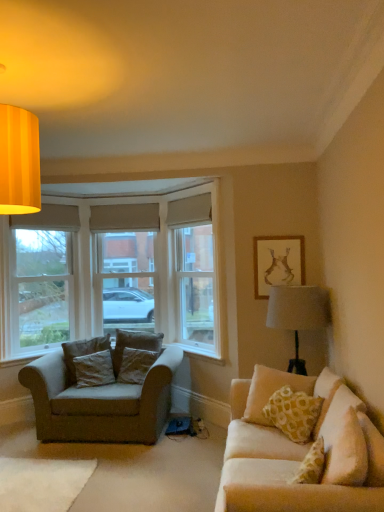
Measure the distance between point (x=124, y=395) and camera.

The depth of point (x=124, y=395) is 4.10 meters.

How much space does dark brown fabric pillow at left, which appears as the fourth pillow when viewed from the right, occupy vertically?

The height of dark brown fabric pillow at left, which appears as the fourth pillow when viewed from the right, is 19.35 inches.

This screenshot has height=512, width=384. What do you see at coordinates (135, 365) in the screenshot?
I see `dark gray fabric pillow at left, positioned as the 3th pillow in left-to-right order` at bounding box center [135, 365].

Describe the element at coordinates (41, 288) in the screenshot. I see `white painted wood window frame at left` at that location.

Measure the distance between white painted wood window frame at left and camera.

white painted wood window frame at left is 14.87 feet away from camera.

Find the location of `matte gold picture frame at upper right`. matte gold picture frame at upper right is located at coordinates (277, 263).

Is dark gray fabric pillow at left, the 3th pillow viewed from the front, outside of beige fabric window screen at center?

That's correct, dark gray fabric pillow at left, the 3th pillow viewed from the front, is outside of beige fabric window screen at center.

Is beige fabric window screen at center at the back of dark gray fabric pillow at left, which is the 2th pillow in back-to-front order?

No, dark gray fabric pillow at left, which is the 2th pillow in back-to-front order, is not facing away from beige fabric window screen at center.

Which object is wider, dark gray fabric pillow at left, placed as the 2th pillow when sorted from right to left, or beige fabric window screen at center?

beige fabric window screen at center is wider.

Considering the positions of points (138, 332) and (140, 432), is point (138, 332) farther from camera compared to point (140, 432)?

Yes.

Is textured beige pillow at center-left, which is the first pillow in back-to-front order, located outside velvet beige armchair at left?

No, textured beige pillow at center-left, which is the first pillow in back-to-front order, is not outside of velvet beige armchair at left.

Does textured beige pillow at center-left, placed as the second pillow when sorted from left to right, have a lesser width compared to velvet beige armchair at left?

Indeed, textured beige pillow at center-left, placed as the second pillow when sorted from left to right, has a lesser width compared to velvet beige armchair at left.

How distant is textured beige pillow at center-left, which ranks as the third pillow in right-to-left order, from dark gray fabric pillow at left, placed as the 2th pillow when sorted from right to left?

textured beige pillow at center-left, which ranks as the third pillow in right-to-left order, is 4.35 inches away from dark gray fabric pillow at left, placed as the 2th pillow when sorted from right to left.

Based on the photo, does textured beige pillow at center-left, placed as the second pillow when sorted from left to right, lie in front of dark gray fabric pillow at left, which is the 2th pillow in back-to-front order?

No, it is behind dark gray fabric pillow at left, which is the 2th pillow in back-to-front order.

Does textured beige pillow at center-left, which ranks as the 4th pillow in front-to-back order, have a larger size compared to dark gray fabric pillow at left, positioned as the 3th pillow in left-to-right order?

Yes.

From a real-world perspective, which is physically below, textured beige pillow at center-left, which ranks as the third pillow in right-to-left order, or beige fabric window screen at center?

textured beige pillow at center-left, which ranks as the third pillow in right-to-left order, is physically lower.

Considering the sizes of textured beige pillow at center-left, placed as the second pillow when sorted from left to right, and beige fabric window screen at center in the image, is textured beige pillow at center-left, placed as the second pillow when sorted from left to right, wider or thinner than beige fabric window screen at center?

Clearly, textured beige pillow at center-left, placed as the second pillow when sorted from left to right, has less width compared to beige fabric window screen at center.

How much distance is there between textured beige pillow at center-left, which is the first pillow in back-to-front order, and beige fabric window screen at center?

textured beige pillow at center-left, which is the first pillow in back-to-front order, and beige fabric window screen at center are 36.01 inches apart.

Which object is more forward, textured beige pillow at center-left, which ranks as the 4th pillow in front-to-back order, or beige fabric window screen at center?

beige fabric window screen at center is closer to the camera.

From a real-world perspective, is dark brown fabric pillow at left, the third pillow viewed from the back, on matte gold picture frame at upper right?

Actually, dark brown fabric pillow at left, the third pillow viewed from the back, is physically below matte gold picture frame at upper right in the real world.

In the scene shown: Considering the relative sizes of dark brown fabric pillow at left, the 2th pillow in the front-to-back sequence, and matte gold picture frame at upper right in the image provided, is dark brown fabric pillow at left, the 2th pillow in the front-to-back sequence, bigger than matte gold picture frame at upper right?

Yes.

Image resolution: width=384 pixels, height=512 pixels. Identify the location of pillow that is the 1st one when counting backward from the matte gold picture frame at upper right. (94, 369).

In the scene shown: From the image's perspective, is dark brown fabric pillow at left, the third pillow viewed from the back, beneath matte gold picture frame at upper right?

Yes, from the image's perspective, dark brown fabric pillow at left, the third pillow viewed from the back, is beneath matte gold picture frame at upper right.

Considering the sizes of dark gray fabric pillow at left, the 3th pillow viewed from the front, and velvet beige armchair at left in the image, is dark gray fabric pillow at left, the 3th pillow viewed from the front, taller or shorter than velvet beige armchair at left?

In the image, dark gray fabric pillow at left, the 3th pillow viewed from the front, appears to be shorter than velvet beige armchair at left.

Are dark gray fabric pillow at left, positioned as the 3th pillow in left-to-right order, and velvet beige armchair at left making contact?

No, dark gray fabric pillow at left, positioned as the 3th pillow in left-to-right order, is not touching velvet beige armchair at left.

From the image's perspective, between dark gray fabric pillow at left, placed as the 2th pillow when sorted from right to left, and velvet beige armchair at left, who is located below?

From the image's view, velvet beige armchair at left is below.

Consider the image. Considering the positions of objects dark gray fabric pillow at left, which is the 2th pillow in back-to-front order, and velvet beige armchair at left in the image provided, who is more to the left, dark gray fabric pillow at left, which is the 2th pillow in back-to-front order, or velvet beige armchair at left?

From the viewer's perspective, velvet beige armchair at left appears more on the left side.

Looking at their sizes, would you say velvet beige pillow at right, the fourth pillow in the left-to-right sequence, is wider or thinner than matte gold picture frame at upper right?

In the image, velvet beige pillow at right, the fourth pillow in the left-to-right sequence, appears to be wider than matte gold picture frame at upper right.

Is the surface of velvet beige pillow at right, the 4th pillow when ordered from back to front, in direct contact with matte gold picture frame at upper right?

velvet beige pillow at right, the 4th pillow when ordered from back to front, is not next to matte gold picture frame at upper right, and they're not touching.

From the picture: Is matte gold picture frame at upper right at the back of velvet beige pillow at right, the 4th pillow when ordered from back to front?

That's not correct — velvet beige pillow at right, the 4th pillow when ordered from back to front, is not looking away from matte gold picture frame at upper right.

Which object is positioned more to the left, velvet beige pillow at right, which appears as the 1th pillow when viewed from the right, or matte gold picture frame at upper right?

velvet beige pillow at right, which appears as the 1th pillow when viewed from the right.

From the image's perspective, count 3rd pillows downward from the beige fabric window screen at center and point to it. Please provide its 2D coordinates.

[(135, 365)]

The width and height of the screenshot is (384, 512). In order to click on the 4th pillow above the velvet beige armchair at left (from a real-world perspective) in this screenshot , I will do `click(134, 344)`.

Which object lies nearer to the anchor point dark gray fabric pillow at left, positioned as the 3th pillow in left-to-right order, white painted wood window frame at left or dark brown fabric pillow at left, the 2th pillow in the front-to-back sequence?

Among the two, dark brown fabric pillow at left, the 2th pillow in the front-to-back sequence, is located nearer to dark gray fabric pillow at left, positioned as the 3th pillow in left-to-right order.

When comparing their distances from textured beige pillow at center-left, placed as the second pillow when sorted from left to right, does dark brown fabric pillow at left, the first pillow when ordered from left to right, or velvet beige armchair at left seem further?

velvet beige armchair at left is further to textured beige pillow at center-left, placed as the second pillow when sorted from left to right.

Estimate the real-world distances between objects in this image. Which object is closer to dark brown fabric pillow at left, the first pillow when ordered from left to right, velvet beige armchair at left or velvet beige pillow at right, which appears as the 1th pillow when viewed from the right?

Based on the image, velvet beige armchair at left appears to be nearer to dark brown fabric pillow at left, the first pillow when ordered from left to right.

Considering their positions, is velvet beige pillow at right, which appears as the 1th pillow when viewed from the right, positioned closer to dark brown fabric pillow at left, the 2th pillow in the front-to-back sequence, than matte gold picture frame at upper right?

velvet beige pillow at right, which appears as the 1th pillow when viewed from the right.

Based on their spatial positions, is velvet beige armchair at left or velvet beige pillow at right, which appears as the 1th pillow when viewed from the right, further from matte gold picture frame at upper right?

velvet beige armchair at left is positioned further to the anchor matte gold picture frame at upper right.

Which object lies nearer to the anchor point dark brown fabric pillow at left, the 2th pillow in the front-to-back sequence, velvet beige armchair at left or white painted wood window frame at left?

The object closer to dark brown fabric pillow at left, the 2th pillow in the front-to-back sequence, is velvet beige armchair at left.

When comparing their distances from textured beige pillow at center-left, which is the first pillow in back-to-front order, does velvet beige pillow at right, the 1th pillow viewed from the front, or velvet beige armchair at left seem closer?

velvet beige armchair at left lies closer to textured beige pillow at center-left, which is the first pillow in back-to-front order, than the other object.

Looking at the image, which one is located closer to textured beige pillow at center-left, which ranks as the third pillow in right-to-left order, velvet beige pillow at right, the 4th pillow when ordered from back to front, or beige fabric window screen at center?

beige fabric window screen at center is positioned closer to the anchor textured beige pillow at center-left, which ranks as the third pillow in right-to-left order.

This screenshot has height=512, width=384. Find the location of `window screen located between velvet beige pillow at right, which appears as the 1th pillow when viewed from the right, and dark gray fabric pillow at left, positioned as the 3th pillow in left-to-right order, in the depth direction`. window screen located between velvet beige pillow at right, which appears as the 1th pillow when viewed from the right, and dark gray fabric pillow at left, positioned as the 3th pillow in left-to-right order, in the depth direction is located at coordinates (197, 271).

The height and width of the screenshot is (512, 384). Find the location of `studio couch between dark brown fabric pillow at left, the first pillow when ordered from left to right, and matte gold picture frame at upper right from left to right`. studio couch between dark brown fabric pillow at left, the first pillow when ordered from left to right, and matte gold picture frame at upper right from left to right is located at coordinates tap(103, 397).

Image resolution: width=384 pixels, height=512 pixels. I want to click on pillow located between dark brown fabric pillow at left, which appears as the fourth pillow when viewed from the right, and dark gray fabric pillow at left, which is the 2th pillow in back-to-front order, in the left-right direction, so click(x=134, y=344).

The height and width of the screenshot is (512, 384). I want to click on window screen situated between textured beige pillow at center-left, placed as the second pillow when sorted from left to right, and matte gold picture frame at upper right from left to right, so click(197, 271).